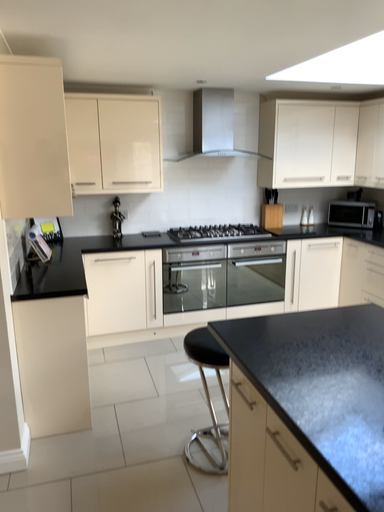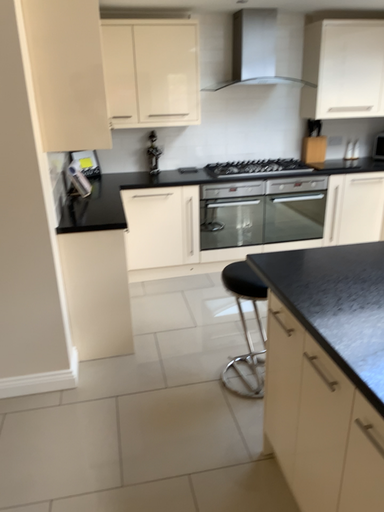
Question: How did the camera likely rotate when shooting the video?

Choices:
 (A) rotated upward
 (B) rotated downward

Answer: (B)